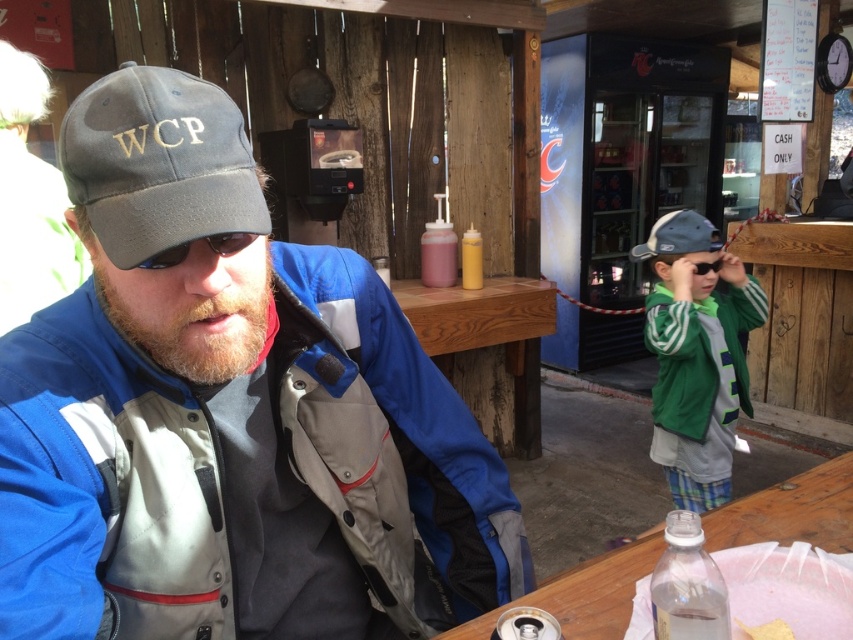
Can you confirm if gray fabric baseball cap at upper left is positioned above black plastic goggles at upper center?

No.

Is gray fabric baseball cap at upper left taller than black plastic goggles at upper center?

Yes.

Which is behind, point (125, 138) or point (700, 275)?

Positioned behind is point (700, 275).

What are the coordinates of `gray fabric baseball cap at upper left` in the screenshot? It's located at (158, 163).

Is gray fabric baseball cap at upper left positioned at the back of green fleece jacket at right?

No.

Can you confirm if gray fabric baseball cap at upper left is thinner than green fleece jacket at right?

Indeed, gray fabric baseball cap at upper left has a lesser width compared to green fleece jacket at right.

Between point (235, 225) and point (677, 493), which one is positioned in front?

Point (235, 225)

Locate an element on the screen. The width and height of the screenshot is (853, 640). gray fabric baseball cap at upper left is located at coordinates (158, 163).

Is wooden table at lower right to the left of matte black goggles at center from the viewer's perspective?

No, wooden table at lower right is not to the left of matte black goggles at center.

Based on the photo, does wooden table at lower right have a greater width compared to matte black goggles at center?

Correct, the width of wooden table at lower right exceeds that of matte black goggles at center.

Which is in front, point (741, 502) or point (154, 253)?

Positioned in front is point (154, 253).

Locate an element on the screen. wooden table at lower right is located at coordinates (790, 512).